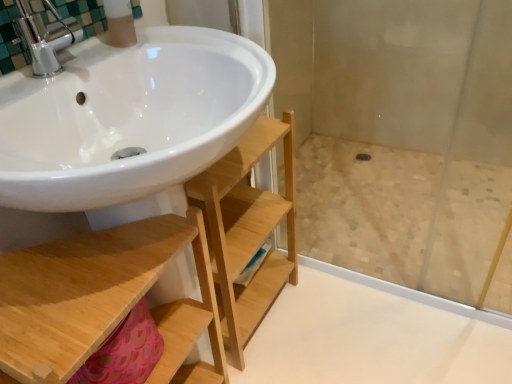
The width and height of the screenshot is (512, 384). I want to click on empty space that is ontop of transparent glass shower door at center (from a real-world perspective), so click(373, 203).